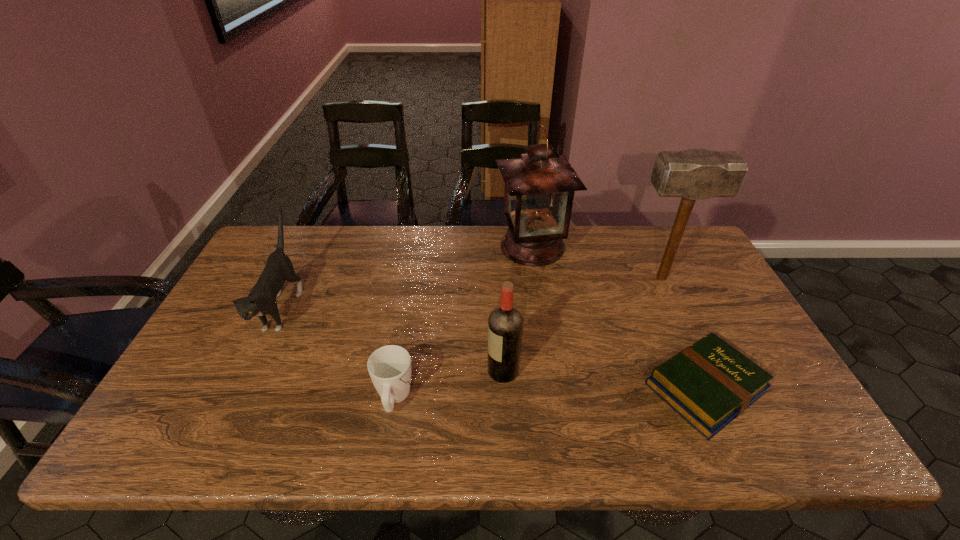
Find the location of `object present at the near right corner`. object present at the near right corner is located at coordinates (710, 383).

Locate an element on the screen. Image resolution: width=960 pixels, height=540 pixels. vacant space at the far edge of the desktop is located at coordinates (603, 242).

Identify the location of vacant space at the near edge of the desktop. (461, 420).

Image resolution: width=960 pixels, height=540 pixels. In the image, there is a desktop. Find the location of `vacant space at the left edge`. vacant space at the left edge is located at coordinates (237, 312).

Locate an element on the screen. Image resolution: width=960 pixels, height=540 pixels. vacant space at the right edge of the desktop is located at coordinates (693, 332).

Locate an element on the screen. The image size is (960, 540). vacant point at the near right corner is located at coordinates (813, 436).

Where is `vacant space that's between the book and the mallet`? This screenshot has height=540, width=960. vacant space that's between the book and the mallet is located at coordinates (684, 333).

This screenshot has width=960, height=540. Identify the location of vacant space in between the mallet and the second shortest object. (528, 338).

At what (x,y) coordinates should I click in order to perform the action: click on free spot between the mallet and the shortest object. Please return your answer as a coordinate pair (x, y). This screenshot has height=540, width=960. Looking at the image, I should click on (684, 333).

The width and height of the screenshot is (960, 540). I want to click on empty space that is in between the oil lamp and the leftmost object, so click(x=408, y=276).